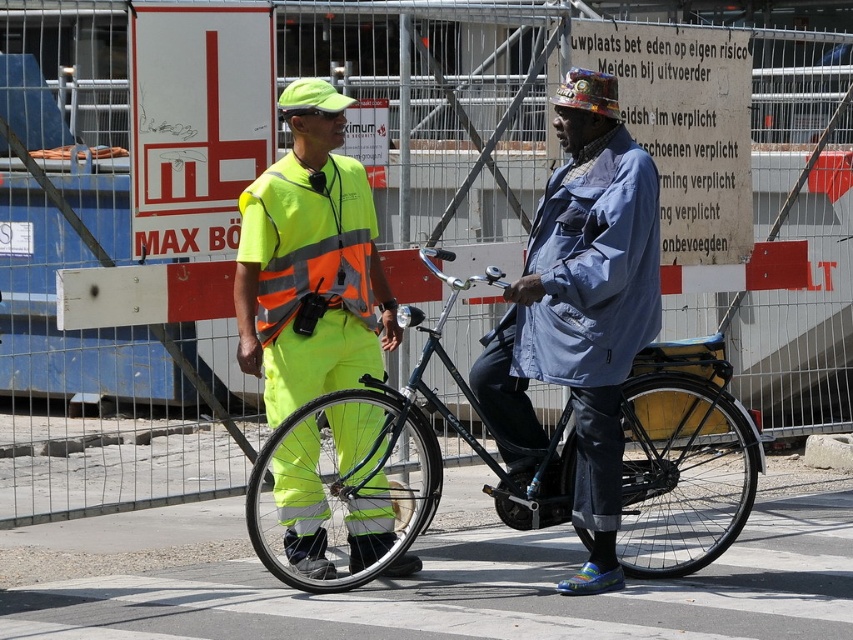
Question: Which point is closer to the camera?

Choices:
 (A) (309, 364)
 (B) (296, 224)

Answer: (B)

Question: From the image, what is the correct spatial relationship of neon yellow reflective vest at center in relation to shiny black bicycle at center?

Choices:
 (A) below
 (B) above

Answer: (B)

Question: Can you confirm if neon yellow reflective vest at center is wider than shiny black bicycle at center?

Choices:
 (A) no
 (B) yes

Answer: (A)

Question: Which object appears farthest from the camera in this image?

Choices:
 (A) denim jacket at center
 (B) shiny black bicycle at center
 (C) neon yellow reflective vest at center
 (D) high-visibility fabric safety vest at left

Answer: (D)

Question: Which point is farther to the camera?

Choices:
 (A) shiny black bicycle at center
 (B) high-visibility fabric safety vest at left
 (C) denim jacket at center
 (D) neon yellow reflective vest at center

Answer: (B)

Question: Does neon yellow reflective vest at center have a larger size compared to high-visibility fabric safety vest at left?

Choices:
 (A) no
 (B) yes

Answer: (B)